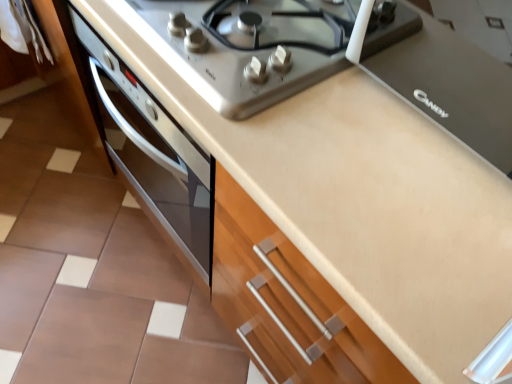
Question: Does black matte stove top at upper center have a larger size compared to satin silver gas stove at upper center?

Choices:
 (A) no
 (B) yes

Answer: (B)

Question: Considering the relative positions of black matte stove top at upper center and satin silver gas stove at upper center in the image provided, is black matte stove top at upper center behind satin silver gas stove at upper center?

Choices:
 (A) no
 (B) yes

Answer: (A)

Question: Considering the relative sizes of black matte stove top at upper center and satin silver gas stove at upper center in the image provided, is black matte stove top at upper center taller than satin silver gas stove at upper center?

Choices:
 (A) no
 (B) yes

Answer: (B)

Question: Can you confirm if black matte stove top at upper center is shorter than satin silver gas stove at upper center?

Choices:
 (A) no
 (B) yes

Answer: (A)

Question: Can you confirm if black matte stove top at upper center is smaller than satin silver gas stove at upper center?

Choices:
 (A) yes
 (B) no

Answer: (B)

Question: From the image's perspective, is black matte stove top at upper center located beneath satin silver gas stove at upper center?

Choices:
 (A) yes
 (B) no

Answer: (A)

Question: Is satin silver gas stove at upper center at the right side of black matte stove top at upper center?

Choices:
 (A) no
 (B) yes

Answer: (A)

Question: Is satin silver gas stove at upper center positioned with its back to black matte stove top at upper center?

Choices:
 (A) yes
 (B) no

Answer: (B)

Question: Could black matte stove top at upper center be considered to be inside satin silver gas stove at upper center?

Choices:
 (A) no
 (B) yes

Answer: (A)

Question: From a real-world perspective, is satin silver gas stove at upper center on top of black matte stove top at upper center?

Choices:
 (A) yes
 (B) no

Answer: (B)

Question: From the image's perspective, is satin silver gas stove at upper center beneath black matte stove top at upper center?

Choices:
 (A) yes
 (B) no

Answer: (B)

Question: Is satin silver gas stove at upper center thinner than black matte stove top at upper center?

Choices:
 (A) yes
 (B) no

Answer: (B)

Question: From the image's perspective, is black matte stove top at upper center above or below satin silver gas stove at upper center?

Choices:
 (A) below
 (B) above

Answer: (A)